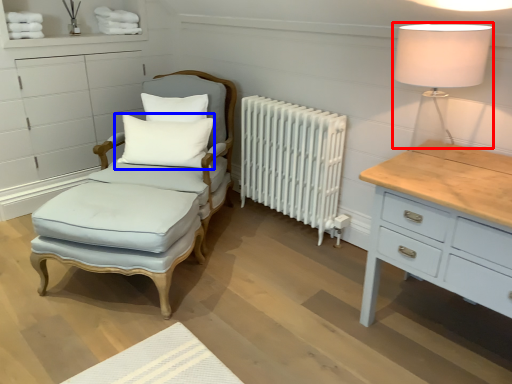
Question: Which point is closer to the camera, table lamp (highlighted by a red box) or pillow (highlighted by a blue box)?

Choices:
 (A) table lamp
 (B) pillow

Answer: (A)